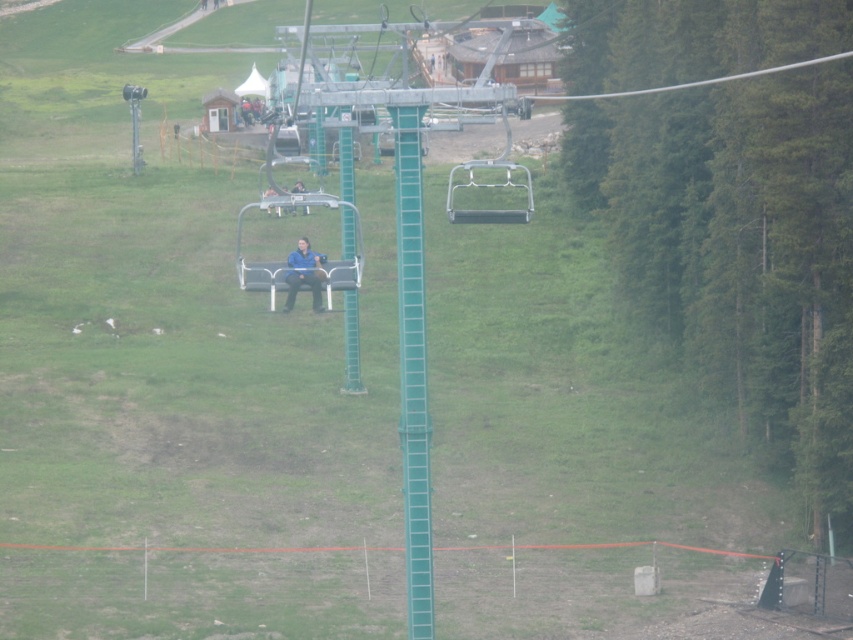
At what (x,y) coordinates should I click in order to perform the action: click on green plastic chair at center. Please return your answer as a coordinate pair (x, y). Looking at the image, I should click on (488, 186).

Does green plastic chair at center appear on the left side of blue fabric jacket at center?

In fact, green plastic chair at center is to the right of blue fabric jacket at center.

Does point (476, 216) lie behind point (299, 243)?

Yes, it is.

Image resolution: width=853 pixels, height=640 pixels. In order to click on green plastic chair at center in this screenshot , I will do `click(488, 186)`.